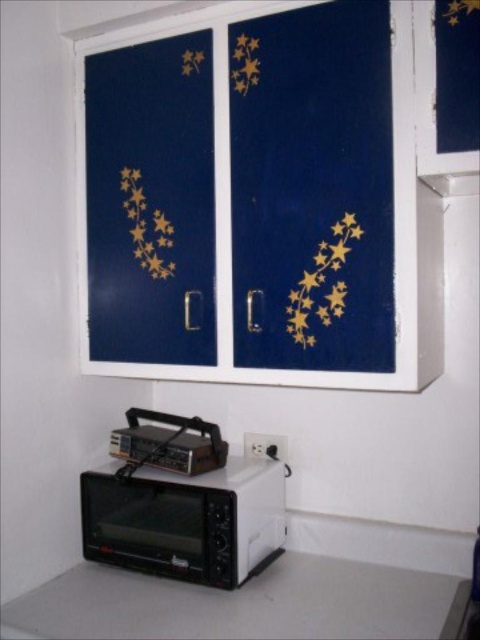
Question: Does blue painted cabinet at upper center have a smaller size compared to transparent glass window at upper right?

Choices:
 (A) no
 (B) yes

Answer: (A)

Question: Does blue painted cabinet at upper center appear on the left side of white matte countertop at lower center?

Choices:
 (A) yes
 (B) no

Answer: (A)

Question: Which object is the farthest from the black plastic microwave at lower left?

Choices:
 (A) white matte countertop at lower center
 (B) blue painted cabinet at upper center

Answer: (B)

Question: Is white matte countertop at lower center thinner than black plastic microwave at lower left?

Choices:
 (A) yes
 (B) no

Answer: (B)

Question: Which point is farther to the camera?

Choices:
 (A) metallic silver toaster oven at lower left
 (B) transparent glass window at upper right
 (C) gold metallic star at upper center
 (D) blue painted cabinet at upper center

Answer: (A)

Question: Which is farther from the black plastic microwave at lower left?

Choices:
 (A) blue painted cabinet at upper center
 (B) transparent glass window at upper right
 (C) white matte countertop at lower center

Answer: (B)